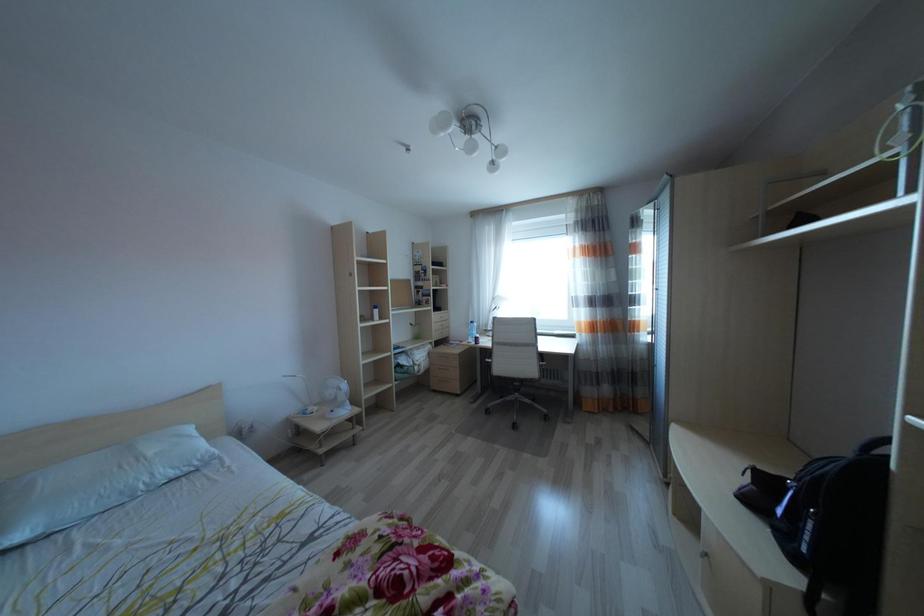
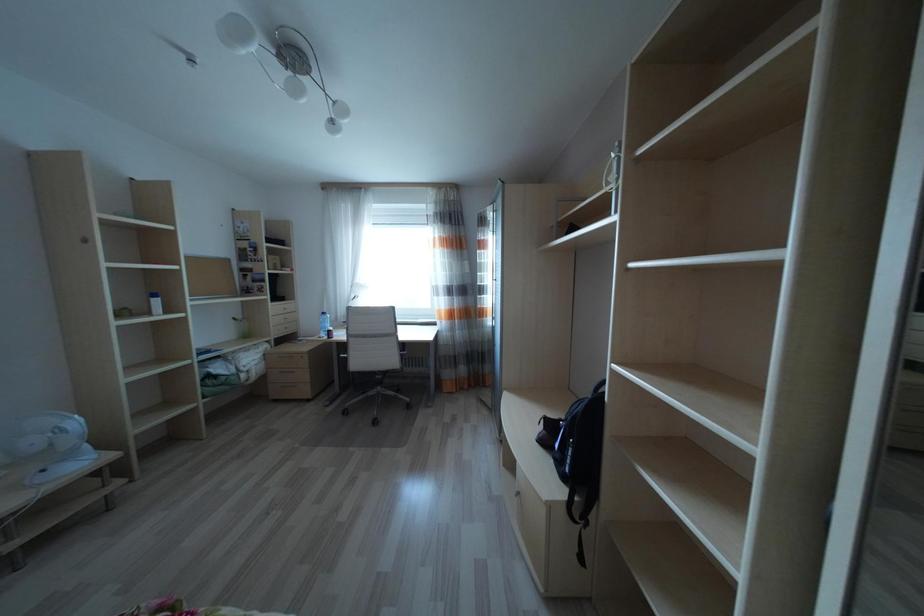
Question: The camera is either moving clockwise (left) or counter-clockwise (right) around the object. The first image is from the beginning of the video and the second image is from the end. Is the camera moving left or right when shooting the video?

Choices:
 (A) Left
 (B) Right

Answer: (A)